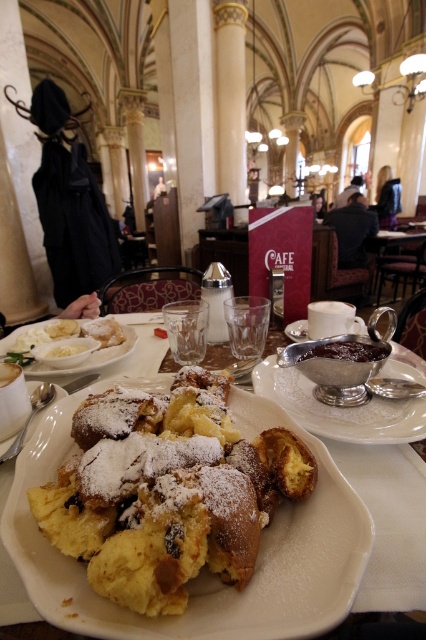
You are a customer at the cafe and want to place your coffee cup on the table. The cup is too hot to hold, so you need to put it on either the silver metallic bowl at center or the silver metallic saucer at center. Which one is closer to the right side of the table so you can reach it easily?

The silver metallic saucer at center is closer to the right side of the table because the silver metallic bowl at center is to the left of it, meaning the saucer is positioned more to the right.